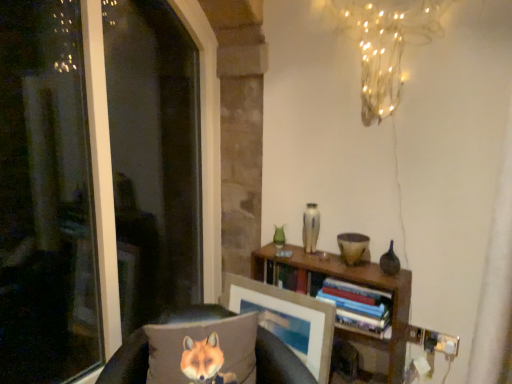
Find the location of a particular element. free space above hardcover books at center (from a real-world perspective) is located at coordinates (359, 284).